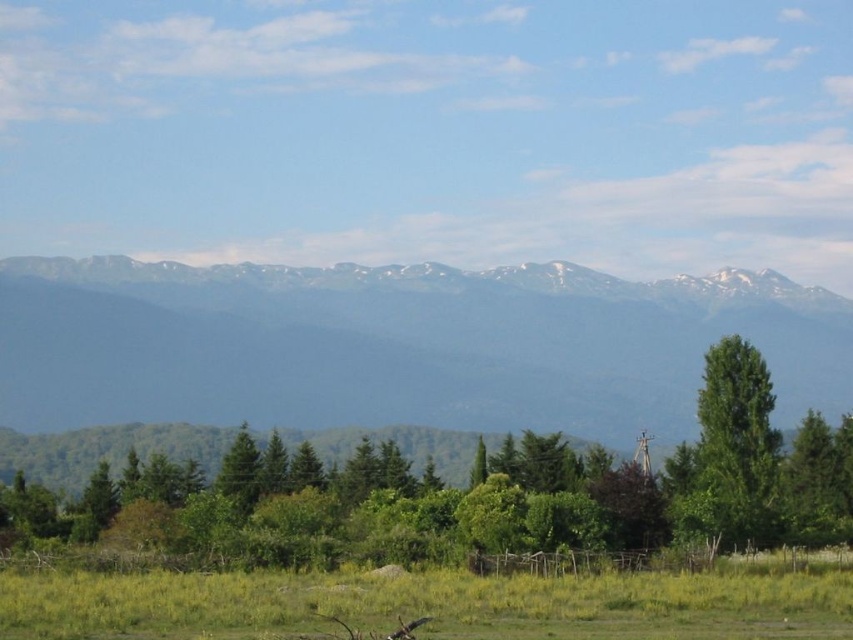
Question: Is grayish-blue mountain range at upper center closer to camera compared to green leafy tree at center?

Choices:
 (A) no
 (B) yes

Answer: (A)

Question: Is green grassy field at lower center below green leafy tree at right?

Choices:
 (A) no
 (B) yes

Answer: (B)

Question: Which point is closer to the camera?

Choices:
 (A) coord(259,288)
 (B) coord(643,611)
 (C) coord(740,417)
 (D) coord(646,461)

Answer: (B)

Question: Does grayish-blue mountain range at upper center have a larger size compared to green grassy field at lower center?

Choices:
 (A) yes
 (B) no

Answer: (A)

Question: Which is farther from the green leafy tree at center?

Choices:
 (A) green leafy tree at right
 (B) green grassy field at lower center
 (C) grayish-blue mountain range at upper center

Answer: (C)

Question: Which object is closer to the camera taking this photo?

Choices:
 (A) green leafy tree at center
 (B) green grassy field at lower center

Answer: (B)